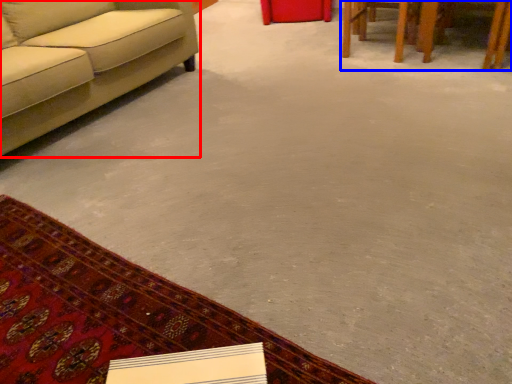
Question: Which object appears farthest to the camera in this image, studio couch (highlighted by a red box) or table (highlighted by a blue box)?

Choices:
 (A) studio couch
 (B) table

Answer: (B)